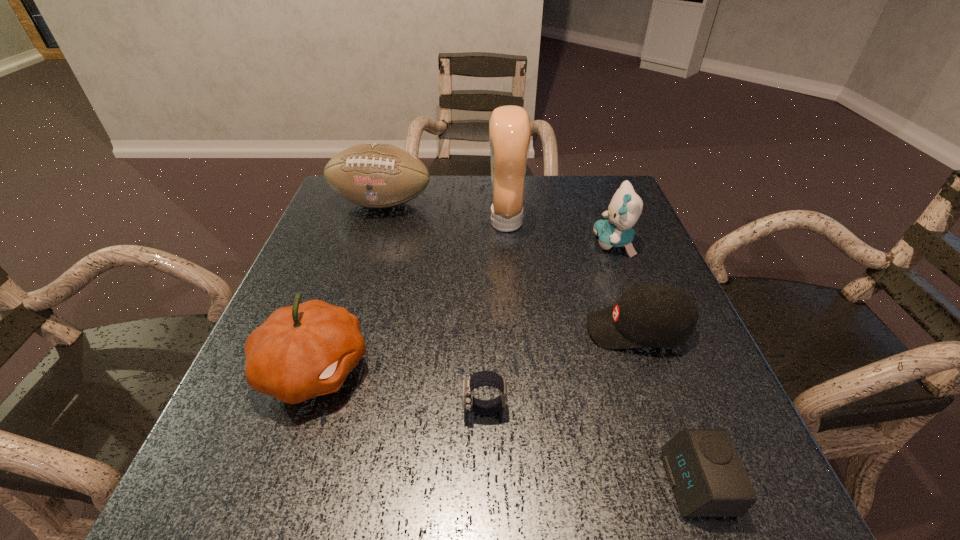
Where is `kitten at the right edge`? This screenshot has height=540, width=960. kitten at the right edge is located at coordinates (625, 208).

Where is `baseball cap located in the right edge section of the desktop`? This screenshot has width=960, height=540. baseball cap located in the right edge section of the desktop is located at coordinates (651, 314).

This screenshot has width=960, height=540. What are the coordinates of `alarm clock that is positioned at the right edge` in the screenshot? It's located at (708, 479).

This screenshot has width=960, height=540. In order to click on object positioned at the far left corner in this screenshot , I will do `click(375, 175)`.

The image size is (960, 540). Find the location of `object at the near right corner`. object at the near right corner is located at coordinates (708, 479).

I want to click on free spot at the far edge of the desktop, so click(559, 218).

Where is `vacant space at the near edge of the desktop`? The image size is (960, 540). vacant space at the near edge of the desktop is located at coordinates (459, 462).

In the image, there is a desktop. At what (x,y) coordinates should I click in order to perform the action: click on vacant space at the left edge. Please return your answer as a coordinate pair (x, y). This screenshot has width=960, height=540. Looking at the image, I should click on (337, 272).

Find the location of `vacant space at the right edge of the desktop`. vacant space at the right edge of the desktop is located at coordinates (688, 399).

Identify the location of vacant space at the near left corner of the desktop. (215, 496).